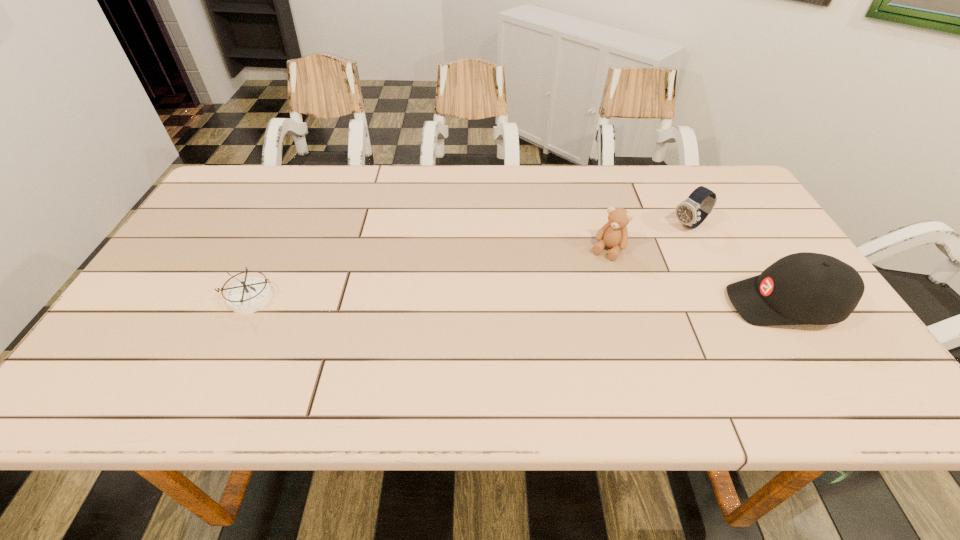
Locate an element on the screen. This screenshot has width=960, height=540. vacant area at the near edge of the desktop is located at coordinates (278, 352).

Locate an element on the screen. This screenshot has width=960, height=540. vacant space at the left edge is located at coordinates (177, 263).

At what (x,y) coordinates should I click in order to perform the action: click on free spot at the far left corner of the desktop. Please return your answer as a coordinate pair (x, y). Looking at the image, I should click on (220, 208).

Locate an element on the screen. The height and width of the screenshot is (540, 960). free space at the near left corner is located at coordinates (144, 349).

Identify the location of free space at the near right corner. (791, 344).

This screenshot has width=960, height=540. I want to click on free area in between the farthest object and the leftmost object, so click(x=469, y=262).

I want to click on vacant space that is in between the baseball cap and the teddy bear, so click(x=696, y=277).

This screenshot has width=960, height=540. In order to click on vacant space that's between the shortest object and the baseball cap in this screenshot , I will do `click(516, 301)`.

In order to click on free spot between the baseball cap and the leftmost object in this screenshot , I will do `click(516, 301)`.

Identify the location of free space that is in between the farthest object and the second object from left to right. This screenshot has height=540, width=960. (648, 238).